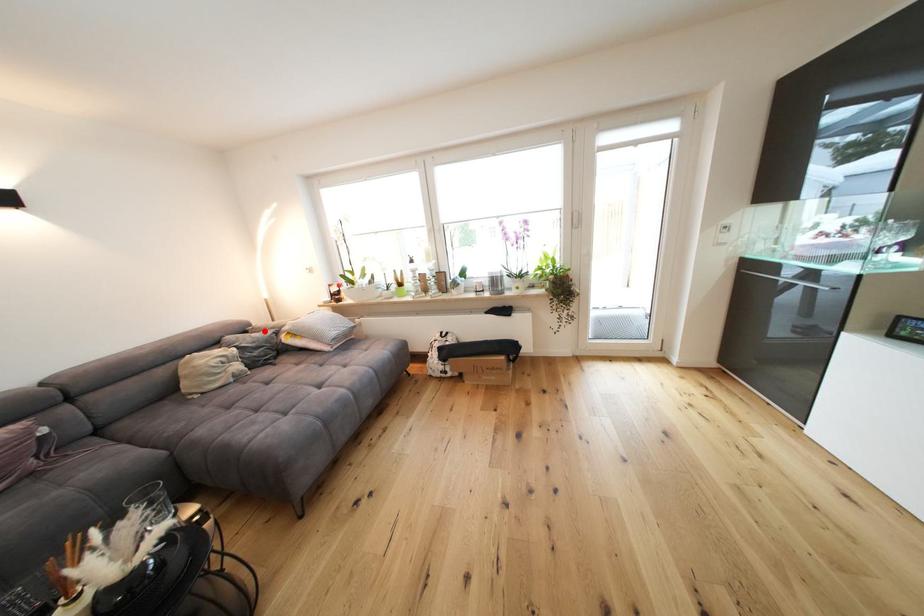
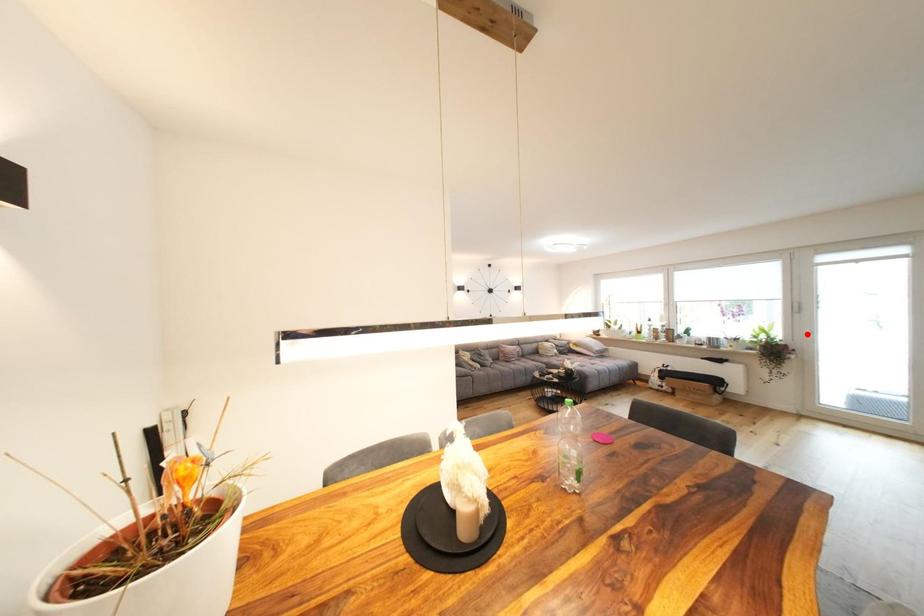
I am providing you with two images of the same scene from different viewpoints. A red point is marked on the first image and another point is marked on the second image. Is the red point in image1 aligned with the point shown in image2?

No